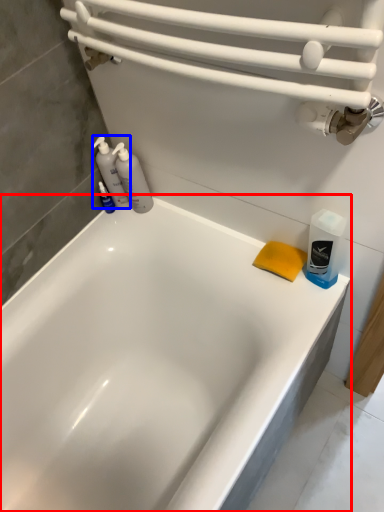
Question: Among these objects, which one is nearest to the camera, bathtub (highlighted by a red box) or cleaning product (highlighted by a blue box)?

Choices:
 (A) bathtub
 (B) cleaning product

Answer: (A)